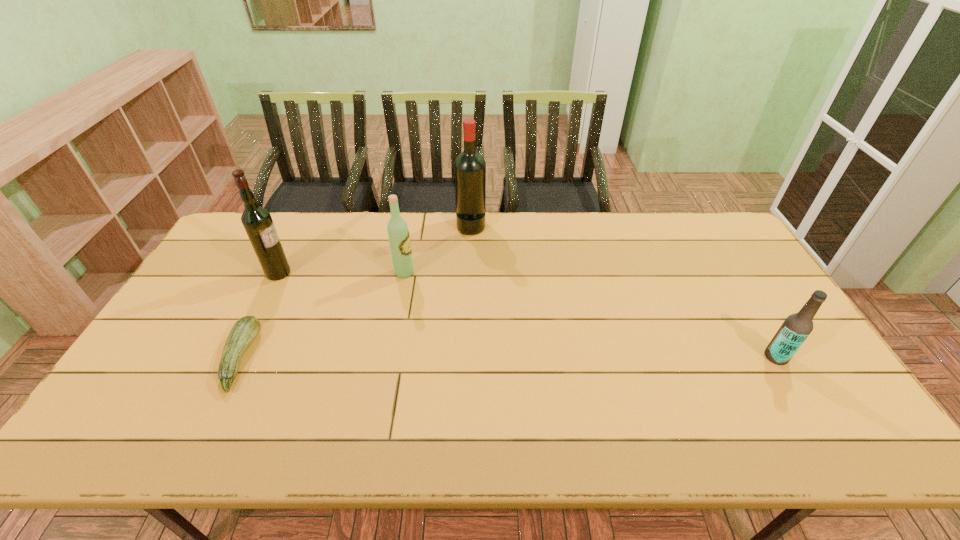
Identify the location of the farthest object. (469, 167).

Identify the location of the rightmost wine bottle. (469, 167).

At what (x,y) coordinates should I click in order to perform the action: click on the leftmost wine bottle. Please return your answer as a coordinate pair (x, y). Looking at the image, I should click on (257, 221).

You are a GUI agent. You are given a task and a screenshot of the screen. Output one action in this format:
    pyautogui.click(x=<x>, y=<y>)
    Task: Click on the third tallest object
    
    Given the screenshot: What is the action you would take?
    pyautogui.click(x=398, y=233)

This screenshot has width=960, height=540. I want to click on the second wine bottle from left to right, so click(398, 233).

Find the location of a particular element. The width and height of the screenshot is (960, 540). the second shortest object is located at coordinates (795, 329).

Find the location of a particular element. the rightmost object is located at coordinates (795, 329).

Find the location of a particular element. The height and width of the screenshot is (540, 960). zucchini is located at coordinates coord(245,330).

What are the coordinates of `vacant space positioned on the left of the second object from right to left` in the screenshot? It's located at (441, 226).

You are a GUI agent. You are given a task and a screenshot of the screen. Output one action in this format:
    pyautogui.click(x=<x>, y=<y>)
    Task: Click on the vacant area situated on the front and back of the leftmost wine bottle
    The width and height of the screenshot is (960, 540).
    Given the screenshot: What is the action you would take?
    pyautogui.click(x=328, y=273)